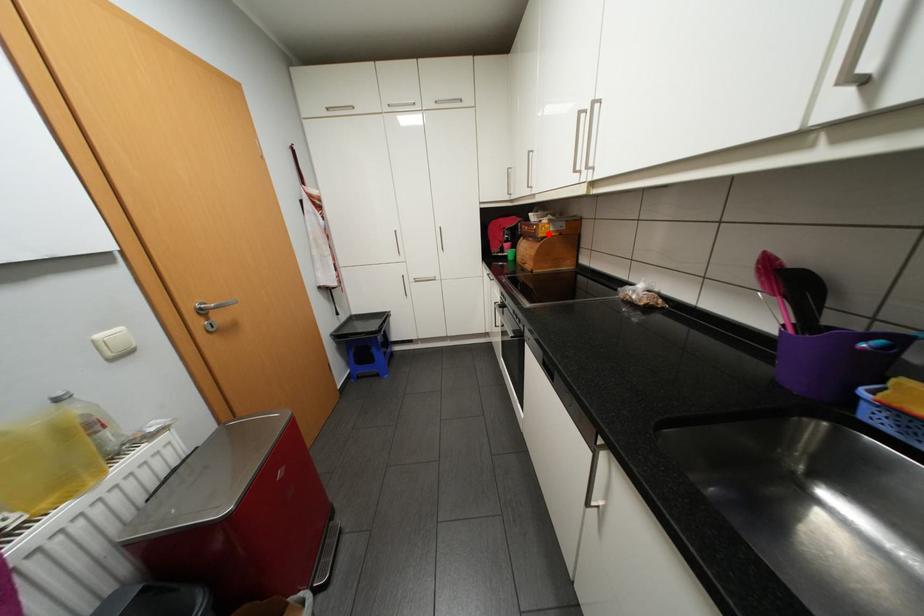
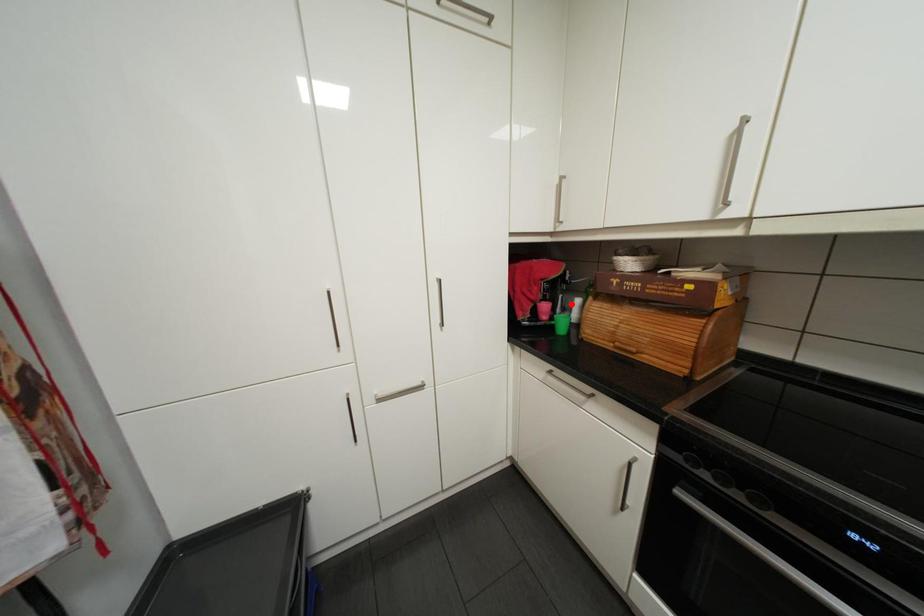
I am providing you with two images of the same scene from different viewpoints. A red point is marked on the first image and another point is marked on the second image. Do the highlighted points in image1 and image2 indicate the same real-world spot?

No